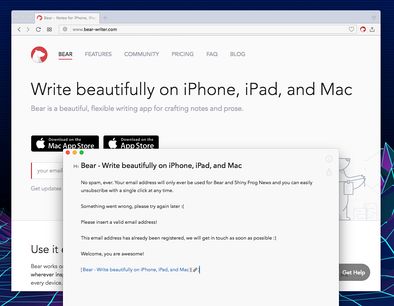
Find the location of `screen`. screen is located at coordinates (46, 295).